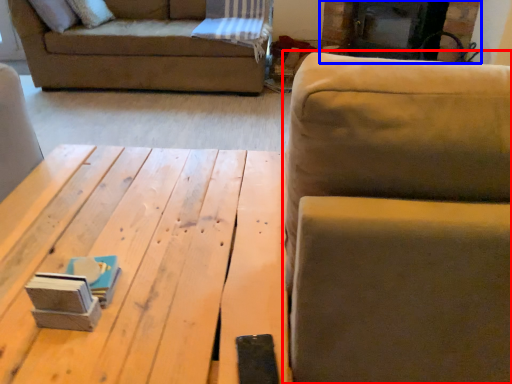
Question: Which object appears closest to the camera in this image, studio couch (highlighted by a red box) or fireplace (highlighted by a blue box)?

Choices:
 (A) studio couch
 (B) fireplace

Answer: (A)